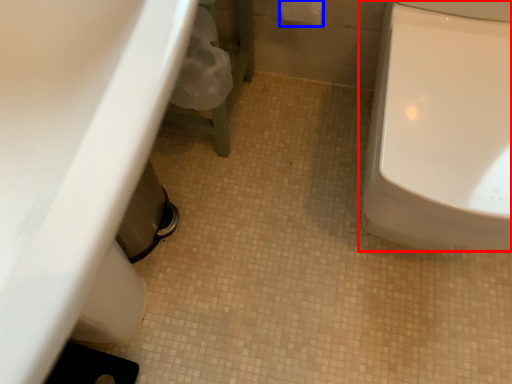
Question: Among these objects, which one is nearest to the camera, toilet (highlighted by a red box) or toilet paper (highlighted by a blue box)?

Choices:
 (A) toilet
 (B) toilet paper

Answer: (A)